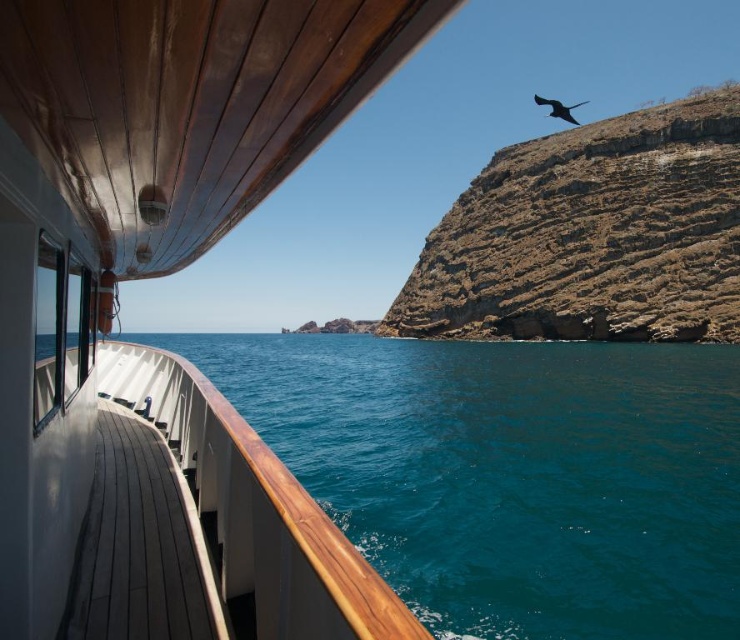
You are standing on the boat deck and want to compare the sizes of the objects in the scene. Which object, the teal glossy water at lower left or the brown rocky cliff at upper right, occupies a larger area in the image?

The brown rocky cliff at upper right occupies a larger area in the image than the teal glossy water at lower left.

You are standing on the boat deck and want to take a photo of the brown rocky cliff at upper right. According to the scene, where should you aim your camera to capture the cliff in the photo?

You should aim your camera at the point (592,236) to capture the brown rocky cliff at upper right as described.